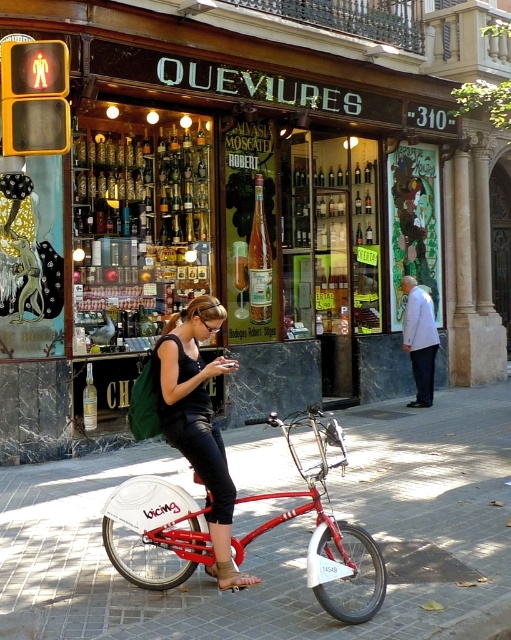
Describe the element at coordinates (321, 522) in the screenshot. I see `shiny red bicycle at center` at that location.

Measure the distance from shiny red bicycle at center to matte black tank top at center.

shiny red bicycle at center and matte black tank top at center are 18.66 inches apart.

What are the coordinates of `shiny red bicycle at center` in the screenshot? It's located at (321, 522).

Is brick pavement at center positioned in front of matte black tank top at center?

That is False.

At what (x,y) coordinates should I click in order to perform the action: click on brick pavement at center. Please return your answer as a coordinate pair (x, y). This screenshot has height=640, width=511. Looking at the image, I should click on (277, 536).

Measure the distance between point [338,632] and camera.

Point [338,632] and camera are 4.24 meters apart from each other.

Locate an element on the screen. This screenshot has width=511, height=640. brick pavement at center is located at coordinates (277, 536).

Can you confirm if brick pavement at center is positioned above shiny red bicycle at center?

Answer: Incorrect, brick pavement at center is not positioned above shiny red bicycle at center.

Can you confirm if brick pavement at center is positioned below shiny red bicycle at center?

Indeed, brick pavement at center is positioned under shiny red bicycle at center.

Image resolution: width=511 pixels, height=640 pixels. What do you see at coordinates (277, 536) in the screenshot? I see `brick pavement at center` at bounding box center [277, 536].

Identify the location of brick pavement at center. (277, 536).